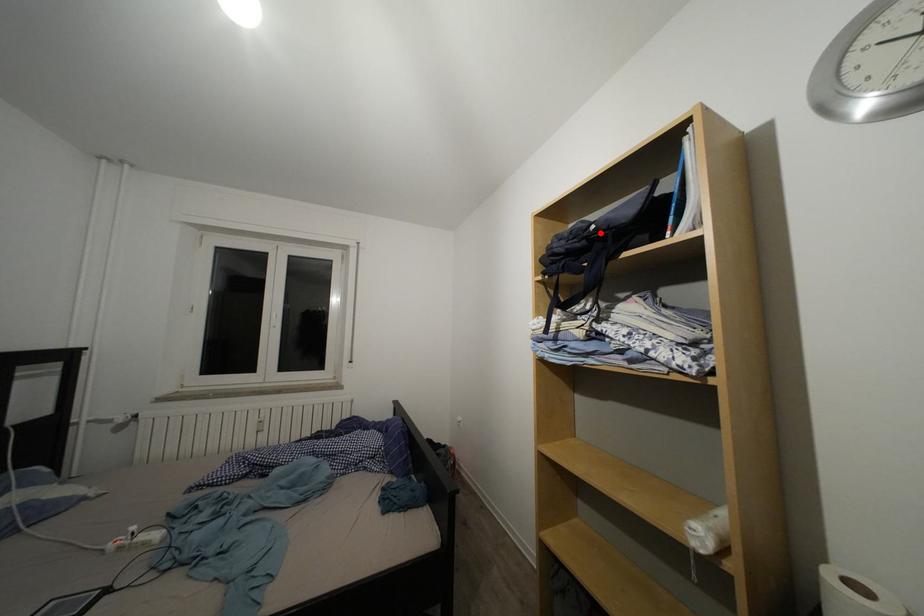
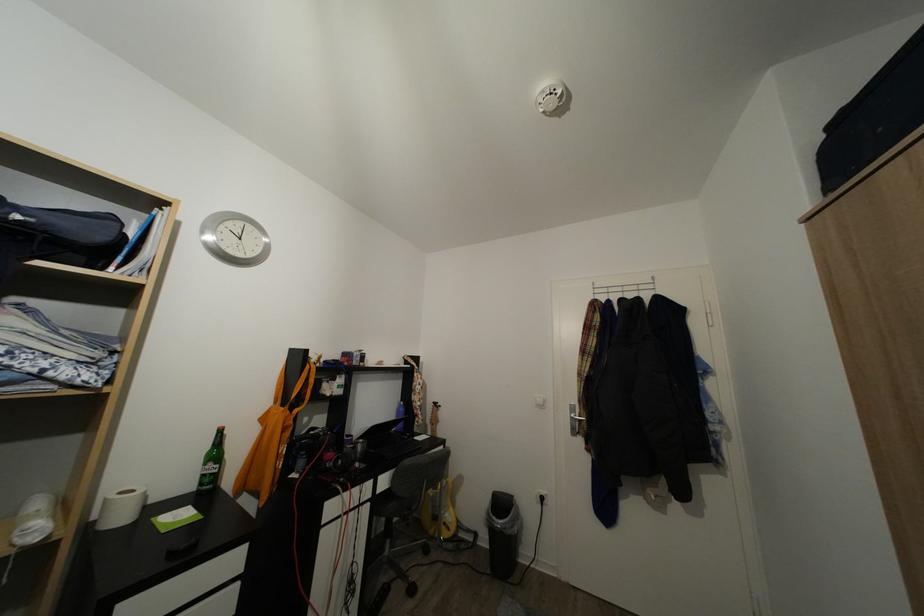
In the second image, find the point that corresponds to the highlighted location in the first image.

(25, 223)